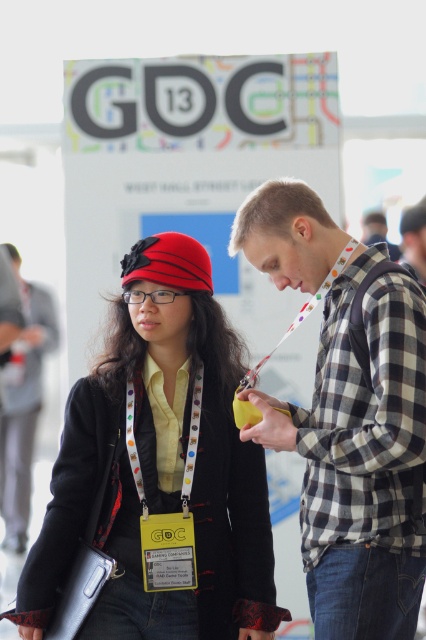
You are a conference attendee trying to decide between two black outerwear options to wear. You see the matte black coat at center and the matte black jacket at center in the image. Which one has a wider silhouette?

The matte black coat at center has a wider silhouette than the matte black jacket at center.

You are a photographer at the GDC 13 conference and need to capture a clear photo of the checkered fabric shirt at center and the yellow fabric lanyard at center. The minimum focus distance for your camera is 36 inches. Can you focus on both items simultaneously?

The checkered fabric shirt at center is 36.49 inches from the yellow fabric lanyard at center. Since the distance between them is slightly over the minimum focus distance of 36 inches, your camera should be able to focus on both items at the same time.

You are a photographer at the GDC 13 conference and need to take a photo of the checkered fabric shirt at center and the matte black jacket at center. Which item should you focus on if you want to capture the one that is shorter in height?

The checkered fabric shirt at center has a lesser height compared to the matte black jacket at center, so you should focus on the checkered fabric shirt at center to capture the shorter one.